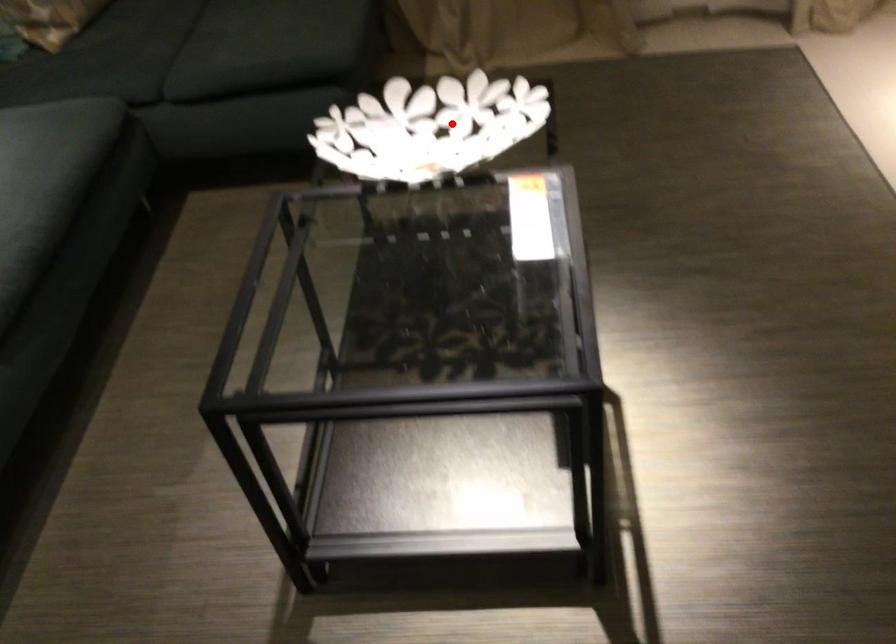
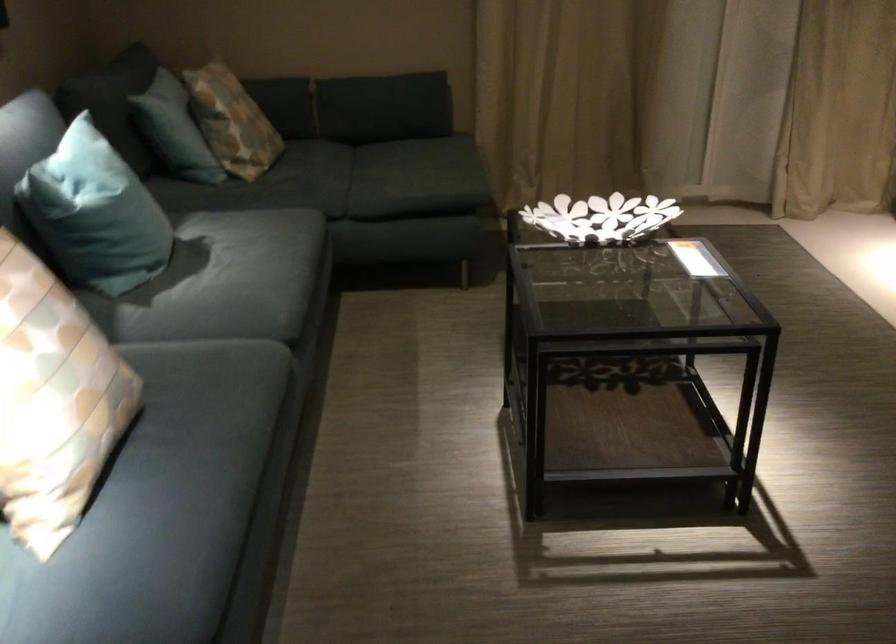
Question: I am providing you with two images of the same scene from different viewpoints. A red point is shown in image1. For the corresponding object point in image2, is it positioned nearer or farther from the camera?

Choices:
 (A) Nearer
 (B) Farther

Answer: (B)